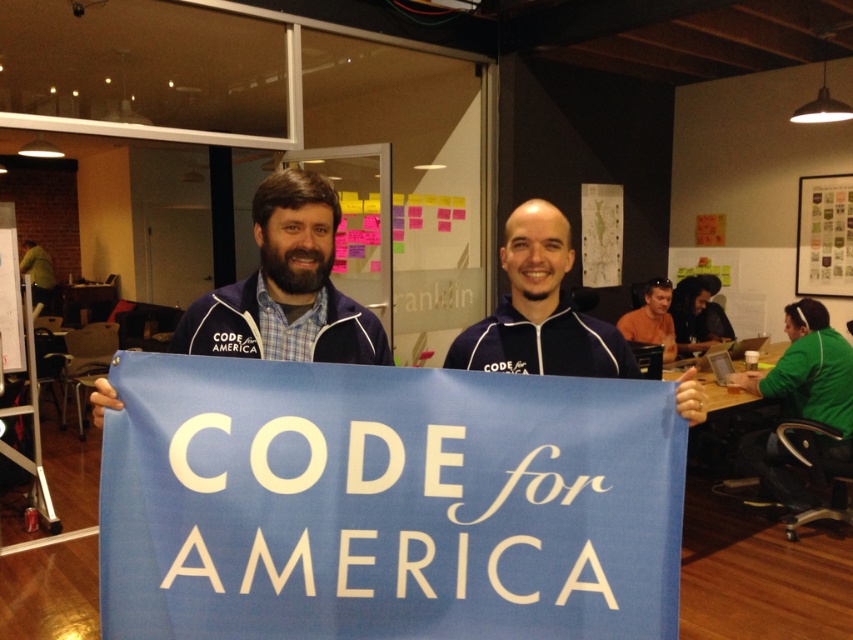
Where is `blue fabric at center`? This screenshot has width=853, height=640. blue fabric at center is located at coordinates (286, 288).

Based on the photo, does blue fabric at center have a smaller size compared to blue fabric banner at center?

No, blue fabric at center is not smaller than blue fabric banner at center.

Image resolution: width=853 pixels, height=640 pixels. Identify the location of blue fabric at center. (286, 288).

From the picture: Which is above, blue fabric at center or orange fabric shirt at upper right?

blue fabric at center is higher up.

Image resolution: width=853 pixels, height=640 pixels. What do you see at coordinates (286, 288) in the screenshot? I see `blue fabric at center` at bounding box center [286, 288].

Does point (344, 310) lie behind point (619, 330)?

No.

This screenshot has height=640, width=853. I want to click on blue fabric at center, so click(286, 288).

Is blue fabric sign at center closer to camera compared to orange fabric shirt at upper right?

That is True.

Between blue fabric sign at center and orange fabric shirt at upper right, which one has less height?

blue fabric sign at center

The height and width of the screenshot is (640, 853). Find the location of `blue fabric sign at center`. blue fabric sign at center is located at coordinates (386, 502).

I want to click on blue fabric sign at center, so click(386, 502).